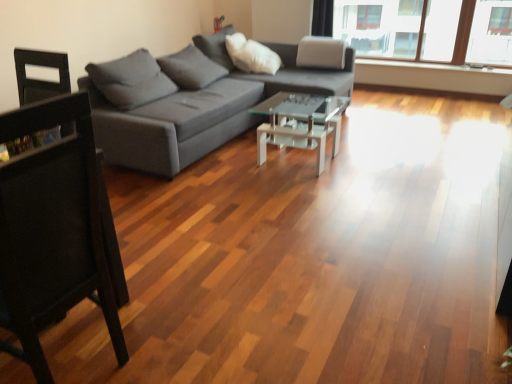
Question: From the image's perspective, is gray fabric couch at center above or below black wood chair at left?

Choices:
 (A) above
 (B) below

Answer: (A)

Question: Considering their positions, is gray fabric couch at center located in front of or behind black wood chair at left?

Choices:
 (A) front
 (B) behind

Answer: (B)

Question: Estimate the real-world distances between objects in this image. Which object is closer to the black wood chair at left?

Choices:
 (A) transparent glass coffee table at center
 (B) gray fabric couch at center

Answer: (B)

Question: Which object is the closest to the black wood chair at left?

Choices:
 (A) gray fabric couch at center
 (B) transparent glass coffee table at center

Answer: (A)